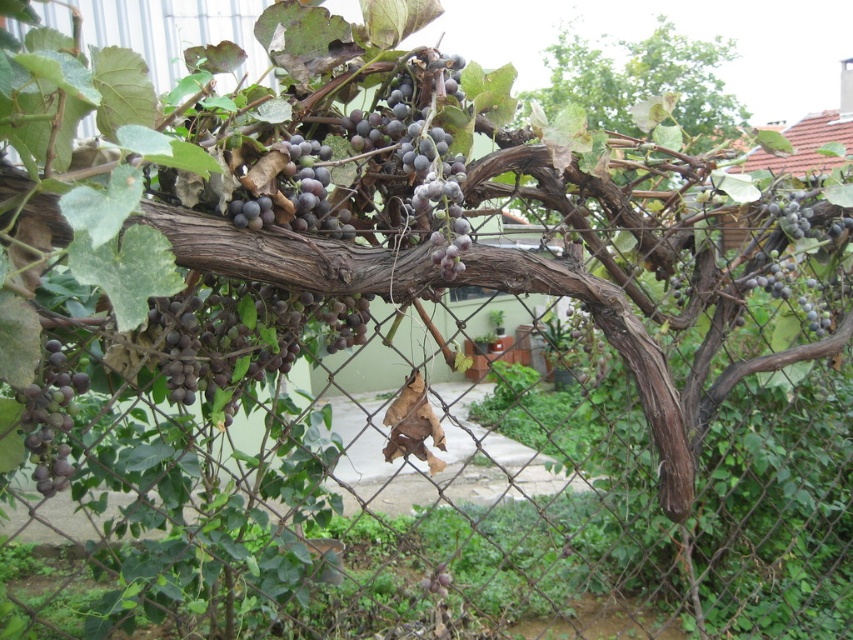
Question: Among these points, which one is farthest from the camera?

Choices:
 (A) (798, 304)
 (B) (804, 225)
 (C) (735, 125)

Answer: (C)

Question: Can you confirm if purple matte grapes at lower left is positioned above dark purple grapes at right?

Choices:
 (A) yes
 (B) no

Answer: (B)

Question: Is the position of dark purple grapes at right more distant than that of dark purple grapes at upper right?

Choices:
 (A) no
 (B) yes

Answer: (B)

Question: Which of these objects is positioned closest to the purple matte grapes at lower left?

Choices:
 (A) dark purple grapes at upper right
 (B) dark purple grapes at right

Answer: (A)

Question: Does purple matte grapes at lower left have a lesser width compared to dark purple grapes at right?

Choices:
 (A) no
 (B) yes

Answer: (B)

Question: Which point is closer to the camera?

Choices:
 (A) (643, 90)
 (B) (811, 234)

Answer: (B)